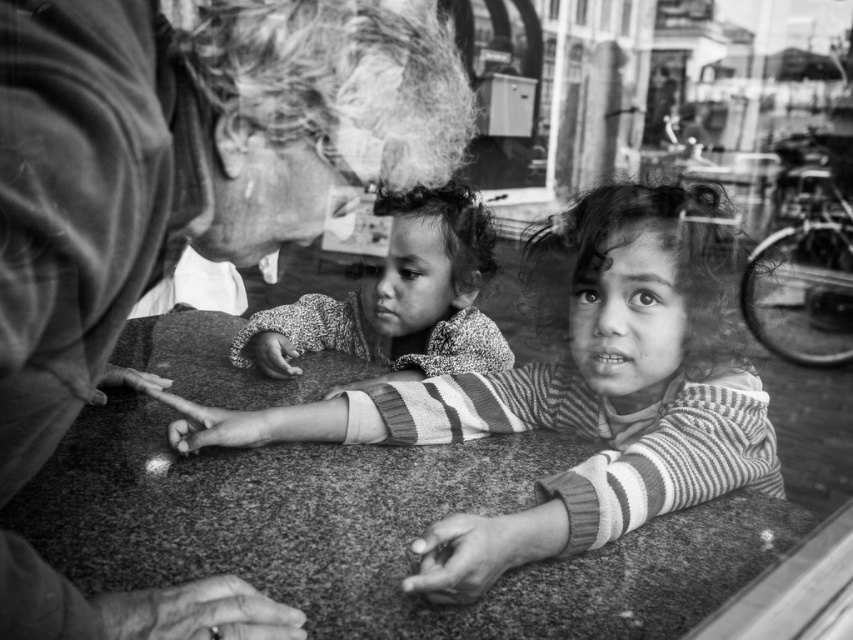
In the scene shown: Is smooth textured hair at upper left to the right of speckled sweater at center from the viewer's perspective?

In fact, smooth textured hair at upper left is to the left of speckled sweater at center.

Consider the image. Is smooth textured hair at upper left to the left of speckled sweater at center from the viewer's perspective?

Indeed, smooth textured hair at upper left is positioned on the left side of speckled sweater at center.

The height and width of the screenshot is (640, 853). Identify the location of smooth textured hair at upper left. (186, 161).

Does smooth textured hair at upper left appear under striped sweater at center?

Incorrect, smooth textured hair at upper left is not positioned below striped sweater at center.

Is smooth textured hair at upper left smaller than striped sweater at center?

Correct, smooth textured hair at upper left occupies less space than striped sweater at center.

This screenshot has width=853, height=640. In order to click on smooth textured hair at upper left in this screenshot , I will do `click(186, 161)`.

Does striped sweater at center have a lesser height compared to speckled sweater at center?

In fact, striped sweater at center may be taller than speckled sweater at center.

At what (x,y) coordinates should I click in order to perform the action: click on striped sweater at center. Please return your answer as a coordinate pair (x, y). Looking at the image, I should click on click(x=573, y=394).

Between point (656, 330) and point (349, 294), which one is positioned behind?

The point (349, 294) is behind.

Identify the location of striped sweater at center. (573, 394).